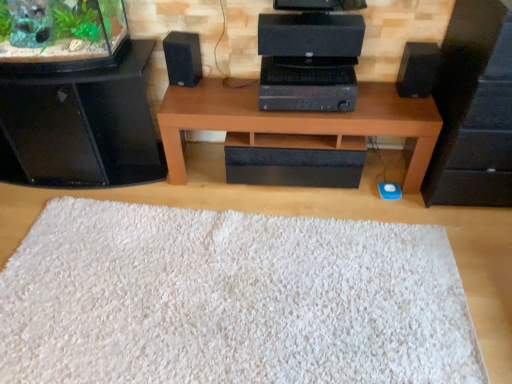
This screenshot has height=384, width=512. I want to click on free space in front of black matte speaker at right, the second furniture from the left, so click(x=480, y=251).